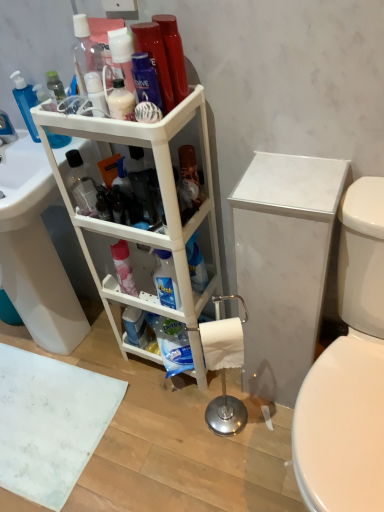
Locate an element on the screen. Image resolution: width=384 pixels, height=512 pixels. vacant space to the right of white paper towel at center is located at coordinates (267, 423).